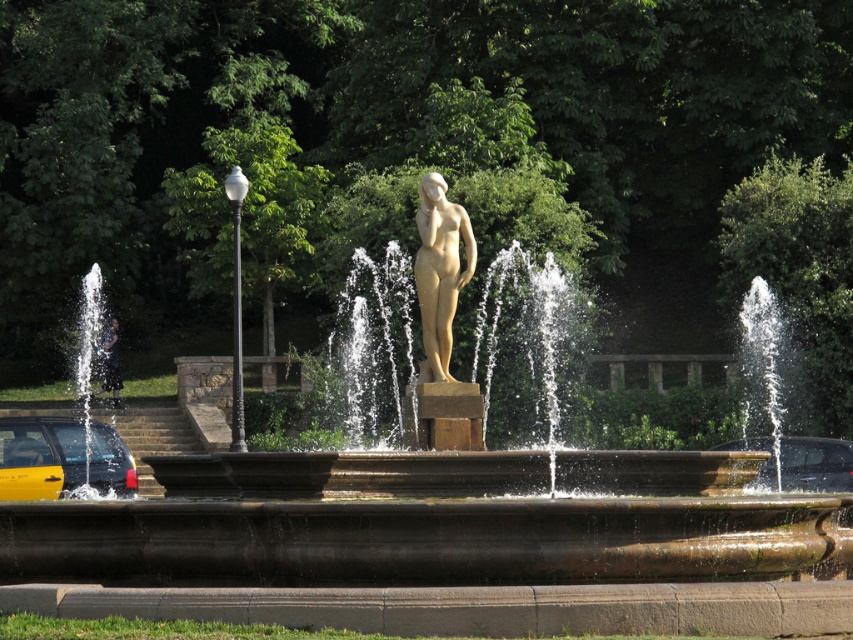
Is gold statue at center to the right of yellow matte taxi at lower left from the viewer's perspective?

Correct, you'll find gold statue at center to the right of yellow matte taxi at lower left.

Can you confirm if gold statue at center is shorter than yellow matte taxi at lower left?

Correct, gold statue at center is not as tall as yellow matte taxi at lower left.

Is point (492, 529) in front of point (35, 486)?

Yes, point (492, 529) is closer to viewer.

At what (x,y) coordinates should I click in order to perform the action: click on gold statue at center. Please return your answer as a coordinate pair (x, y). The height and width of the screenshot is (640, 853). Looking at the image, I should click on (430, 522).

Between yellow matte taxi at lower left and matte gold statue at center, which one appears on the left side from the viewer's perspective?

From the viewer's perspective, yellow matte taxi at lower left appears more on the left side.

Where is `yellow matte taxi at lower left`? yellow matte taxi at lower left is located at coordinates (61, 458).

Is gold statue at center behind matte gold statue at center?

No.

Between gold statue at center and matte gold statue at center, which one appears on the right side from the viewer's perspective?

Positioned to the right is gold statue at center.

Which is in front, point (372, 465) or point (442, 349)?

Point (372, 465)

Identify the location of gold statue at center. (430, 522).